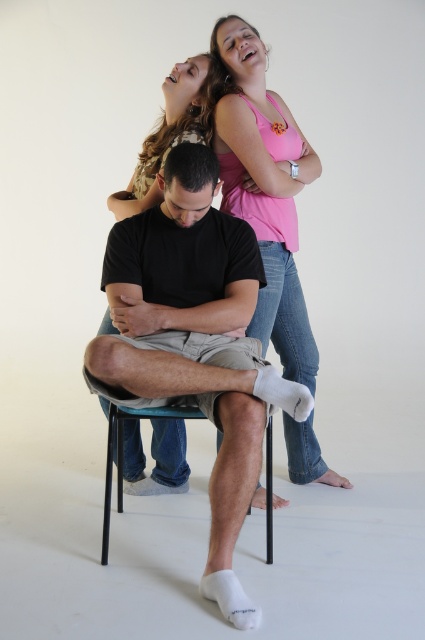
Question: Is black cotton shirt at center smaller than pink cotton tank top at upper center?

Choices:
 (A) yes
 (B) no

Answer: (B)

Question: Considering the real-world distances, which object is farthest from the black cotton shirt at center?

Choices:
 (A) pink cotton tank top at upper center
 (B) black matte arm at center
 (C) pink fabric shirt at upper center
 (D) black plastic chair at lower center

Answer: (C)

Question: Is pink fabric shirt at upper center bigger than black plastic chair at lower center?

Choices:
 (A) no
 (B) yes

Answer: (A)

Question: Which point appears closest to the camera in this image?

Choices:
 (A) (200, 60)
 (B) (153, 209)
 (C) (243, 314)

Answer: (C)

Question: Does pink cotton tank top at upper center appear on the left side of black plastic chair at lower center?

Choices:
 (A) no
 (B) yes

Answer: (A)

Question: Which is nearer to the pink fabric shirt at upper center?

Choices:
 (A) pink cotton tank top at upper center
 (B) black matte arm at center
 (C) black cotton shirt at center

Answer: (B)